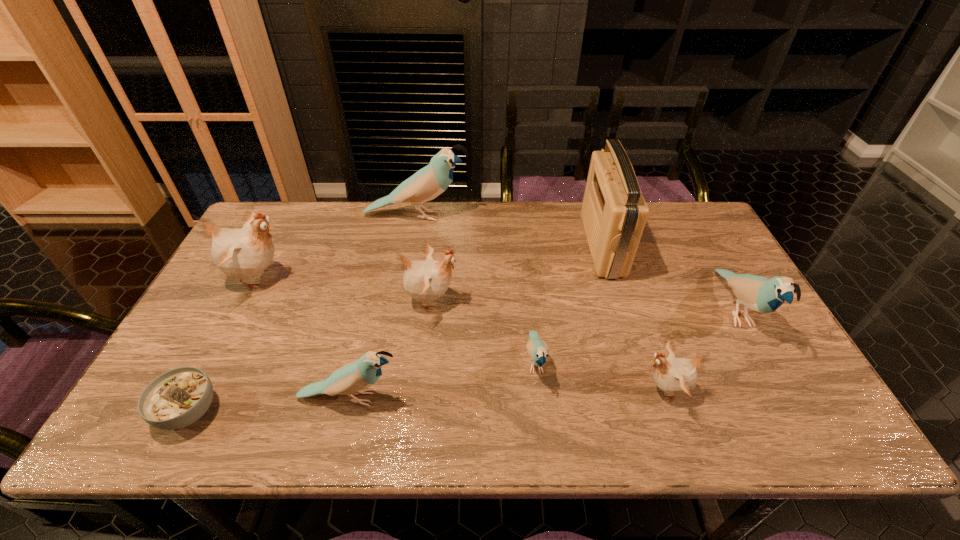
Identify the location of vacant point located between the radio receiver and the third biggest blue bird. (476, 322).

Locate an element on the screen. This screenshot has height=540, width=960. free space between the leftmost bird and the smallest white bird is located at coordinates (462, 334).

Where is `vacant space that's between the beige radio receiver and the smallest white bird`? The width and height of the screenshot is (960, 540). vacant space that's between the beige radio receiver and the smallest white bird is located at coordinates (634, 318).

The height and width of the screenshot is (540, 960). Find the location of `free area in between the sixth object from left to right and the biggest blue bird`. free area in between the sixth object from left to right and the biggest blue bird is located at coordinates (476, 289).

Find the location of a particular element. empty space between the biggest blue bird and the fourth object from right to left is located at coordinates (476, 289).

Where is `free spot between the shortest object and the rightmost blue bird`? free spot between the shortest object and the rightmost blue bird is located at coordinates (462, 361).

I want to click on free space that is in between the beige radio receiver and the rightmost bird, so click(x=669, y=278).

You are a GUI agent. You are given a task and a screenshot of the screen. Output one action in this format:
    pyautogui.click(x=<x>, y=<y>)
    Task: Click on the vacant region between the farthest bird and the second white bird from right to left
    This screenshot has width=960, height=540.
    Given the screenshot: What is the action you would take?
    pyautogui.click(x=423, y=258)

The height and width of the screenshot is (540, 960). Find the location of `free space between the second white bird from right to left and the shortest object`. free space between the second white bird from right to left and the shortest object is located at coordinates (310, 356).

I want to click on object that ranks as the closest to the rightmost blue bird, so click(676, 376).